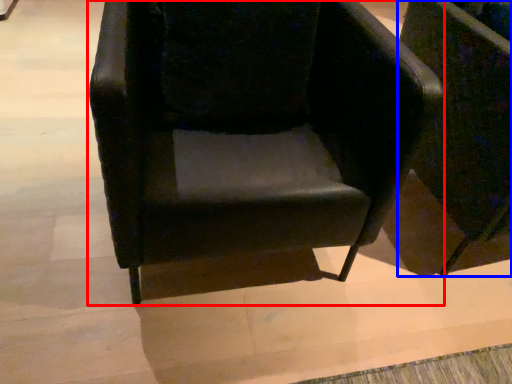
Question: Which of the following is the farthest to the observer, chair (highlighted by a red box) or chair (highlighted by a blue box)?

Choices:
 (A) chair
 (B) chair

Answer: (B)